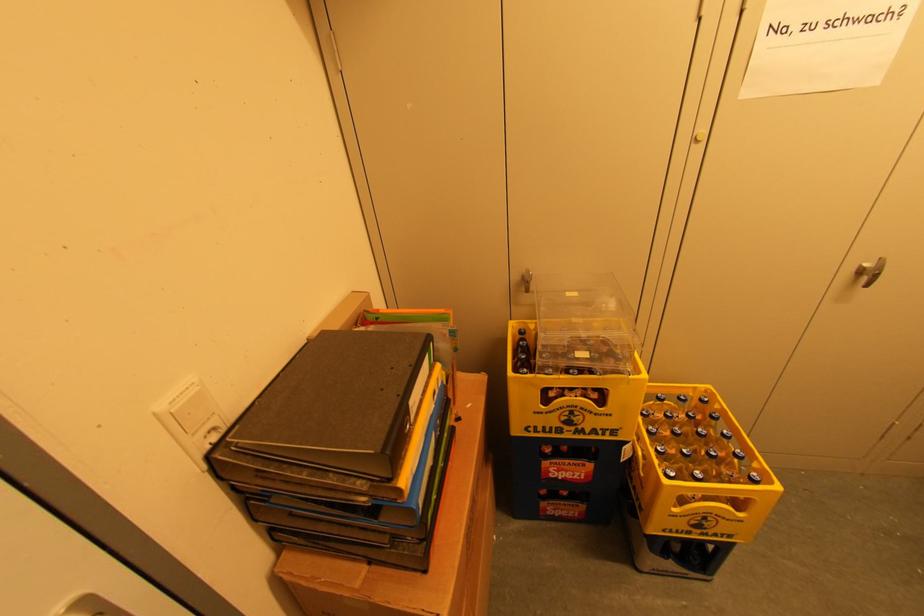
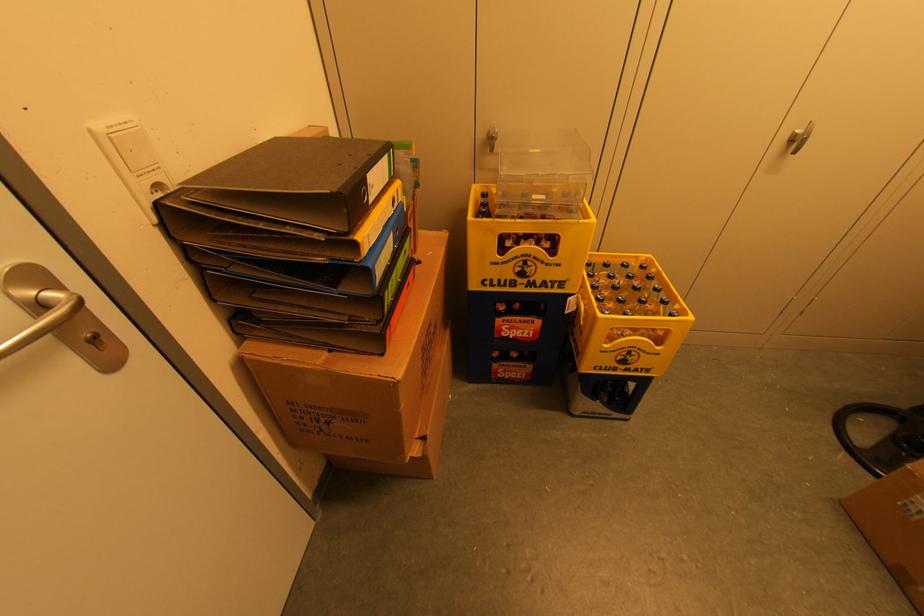
In the second image, find the point that corresponds to pixel 869 275 in the first image.

(798, 142)